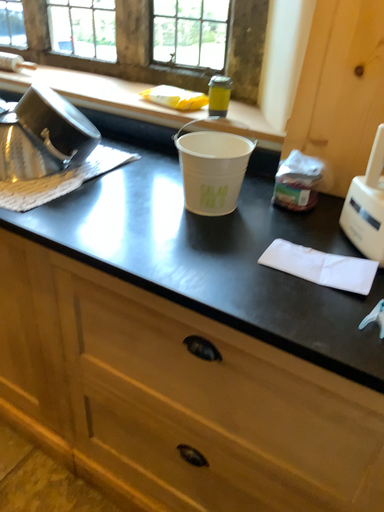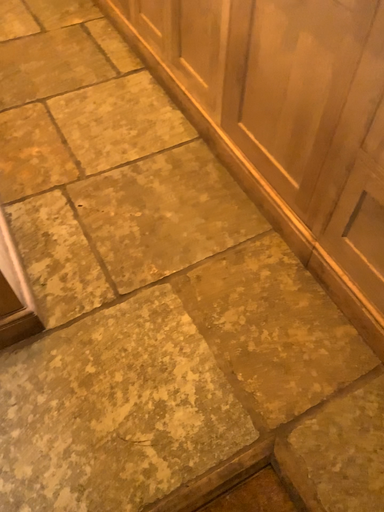
Question: Which way did the camera rotate in the video?

Choices:
 (A) rotated downward
 (B) rotated upward

Answer: (A)